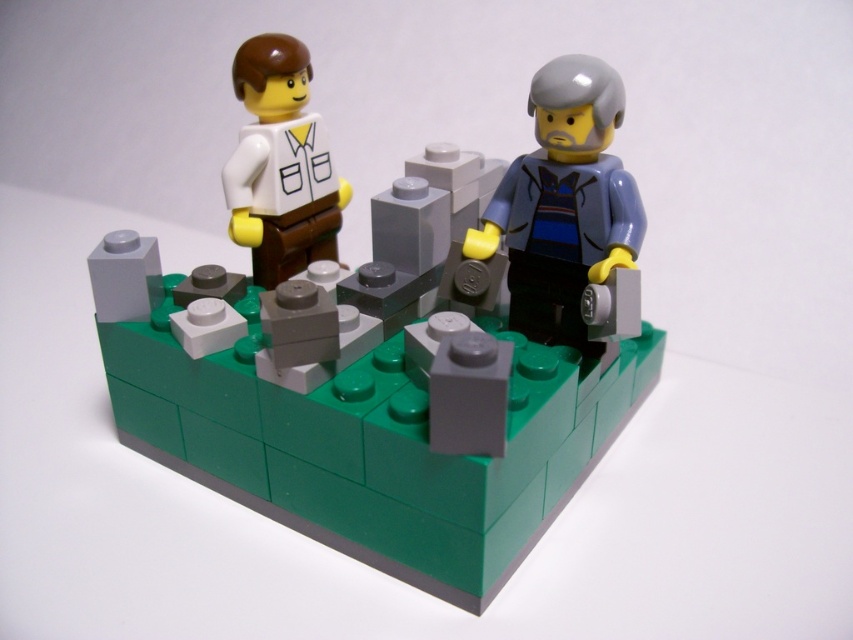
Does matte gray minifigure at center right appear under matte white shirt at upper left?

Correct, matte gray minifigure at center right is located below matte white shirt at upper left.

The image size is (853, 640). Identify the location of matte gray minifigure at center right. (563, 204).

What are the coordinates of `matte gray minifigure at center right` in the screenshot? It's located at (563, 204).

Identify the location of matte white shirt at upper center. This screenshot has width=853, height=640. (396, 333).

Does matte white shirt at upper center have a larger size compared to matte white shirt at upper left?

Indeed, matte white shirt at upper center has a larger size compared to matte white shirt at upper left.

Where is `matte white shirt at upper center`? The image size is (853, 640). matte white shirt at upper center is located at coordinates (396, 333).

Is point (444, 458) closer to viewer compared to point (569, 60)?

Yes, it is in front of point (569, 60).

Does matte white shirt at upper center have a greater height compared to matte gray minifigure at center right?

Yes, matte white shirt at upper center is taller than matte gray minifigure at center right.

Does point (543, 145) come closer to viewer compared to point (566, 188)?

No, it is not.

At what (x,y) coordinates should I click in order to perform the action: click on matte white shirt at upper center. Please return your answer as a coordinate pair (x, y). This screenshot has width=853, height=640. Looking at the image, I should click on (396, 333).